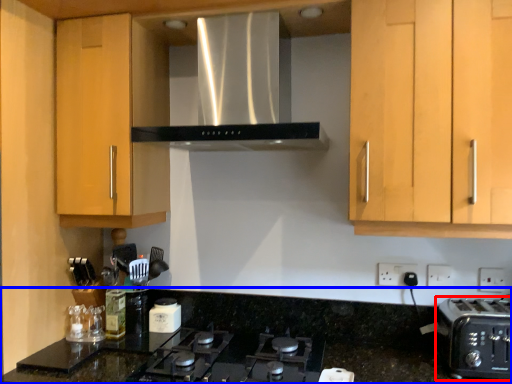
Question: Which object appears closest to the camera in this image, toaster (highlighted by a red box) or countertop (highlighted by a blue box)?

Choices:
 (A) toaster
 (B) countertop

Answer: (B)